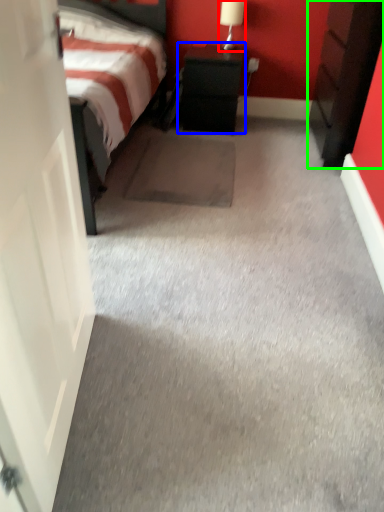
Question: Which object is the closest to the table lamp (highlighted by a red box)? Choose among these: nightstand (highlighted by a blue box) or nightstand (highlighted by a green box).

Choices:
 (A) nightstand
 (B) nightstand

Answer: (A)